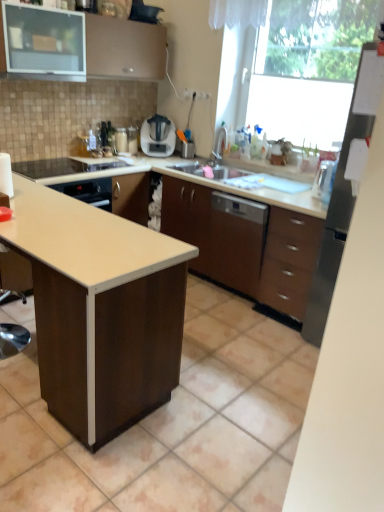
Question: From the image's perspective, is satin nickel faucet at upper right above or below brown matte cabinet at center, the first cabinetry from the right?

Choices:
 (A) above
 (B) below

Answer: (A)

Question: Considering the positions of point (220, 142) and point (168, 193), is point (220, 142) closer or farther from the camera than point (168, 193)?

Choices:
 (A) closer
 (B) farther

Answer: (B)

Question: Which is nearer to the matte brown cabinet at upper left, which is counted as the second cabinetry, starting from the right?

Choices:
 (A) stainless steel refrigerator at right
 (B) beige laminate countertop at center
 (C) brown matte cabinet at center, acting as the 2th cabinetry starting from the left
 (D) white laminate table at center
 (E) satin silver blender at center

Answer: (E)

Question: Which object is positioned farthest from the transparent glass window at upper right?

Choices:
 (A) brown matte cabinet at center, the first cabinetry from the right
 (B) white laminate table at center
 (C) satin silver blender at center
 (D) matte brown cabinet at upper left, which is the 2th cabinetry from bottom to top
 (E) satin nickel faucet at upper right

Answer: (B)